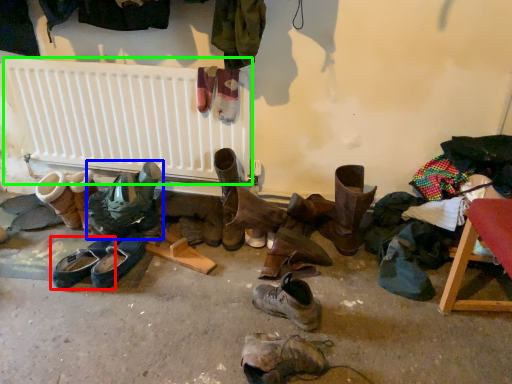
Question: Which is farther away from footwear (highlighted by a red box)? footwear (highlighted by a blue box) or radiator (highlighted by a green box)?

Choices:
 (A) footwear
 (B) radiator

Answer: (B)